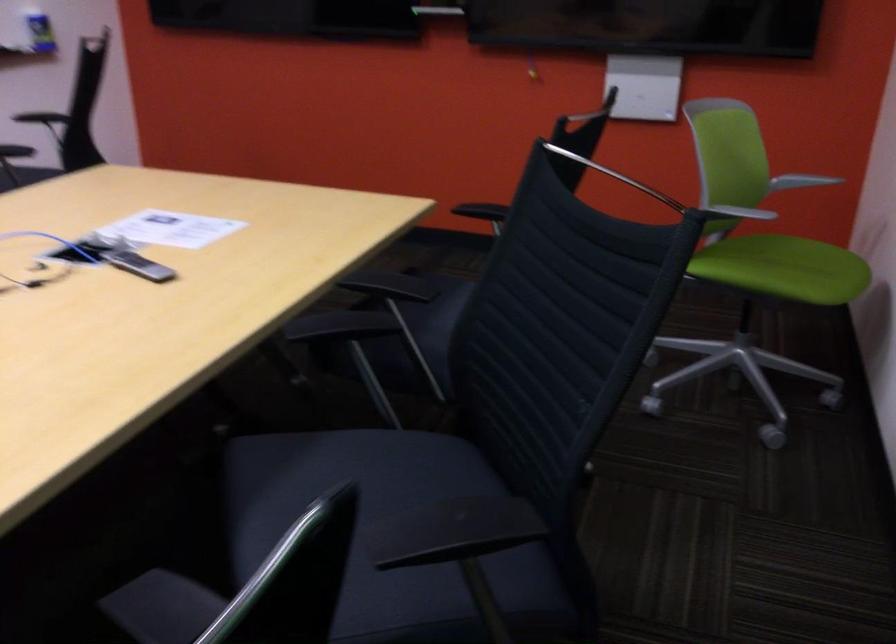
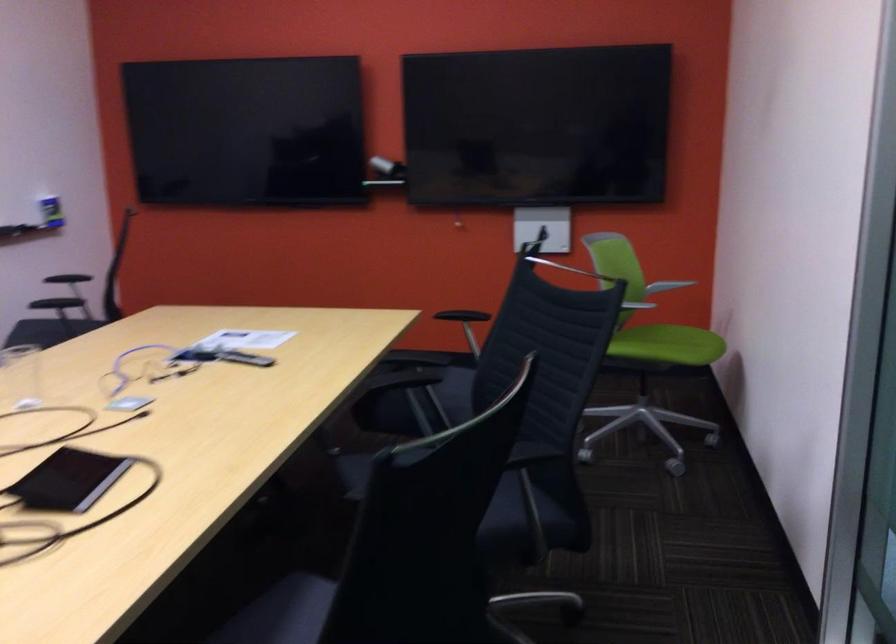
Find the pixel in the second image that matches the point at 780,275 in the first image.

(667, 345)